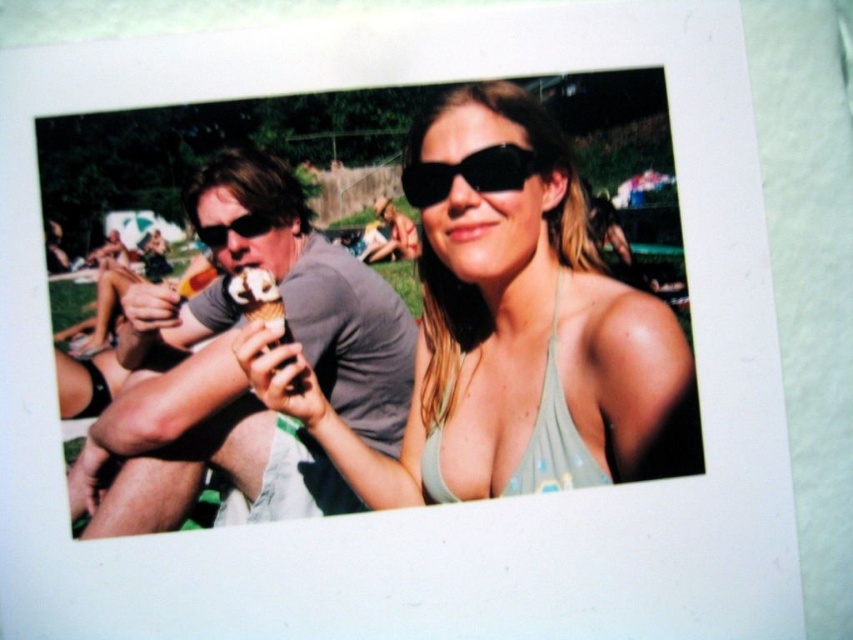
Is light blue fabric bikini top at upper right to the right of vanilla ice cream cone at center from the viewer's perspective?

Yes, light blue fabric bikini top at upper right is to the right of vanilla ice cream cone at center.

Is light blue fabric bikini top at upper right thinner than vanilla ice cream cone at center?

In fact, light blue fabric bikini top at upper right might be wider than vanilla ice cream cone at center.

Measure the distance between light blue fabric bikini top at upper right and camera.

light blue fabric bikini top at upper right is 21.52 inches from camera.

Locate an element on the screen. The width and height of the screenshot is (853, 640). light blue fabric bikini top at upper right is located at coordinates (553, 436).

Where is `light blue fabric bikini top at upper right`? Image resolution: width=853 pixels, height=640 pixels. light blue fabric bikini top at upper right is located at coordinates (553, 436).

Who is shorter, light blue fabric bikini top at upper right or matte black sunglasses at center?

With less height is matte black sunglasses at center.

What are the coordinates of `light blue fabric bikini top at upper right` in the screenshot? It's located at click(553, 436).

Where is `light blue fabric bikini top at upper right`? light blue fabric bikini top at upper right is located at coordinates (553, 436).

Can you confirm if light blue fabric bikini top at upper right is positioned to the left of black plastic sunglasses at upper right?

In fact, light blue fabric bikini top at upper right is to the right of black plastic sunglasses at upper right.

Which is behind, point (437, 492) or point (457, 168)?

The point (437, 492) is more distant.

At what (x,y) coordinates should I click in order to perform the action: click on light blue fabric bikini top at upper right. Please return your answer as a coordinate pair (x, y). Looking at the image, I should click on (553, 436).

The height and width of the screenshot is (640, 853). In order to click on light blue fabric bikini top at upper right in this screenshot , I will do `click(553, 436)`.